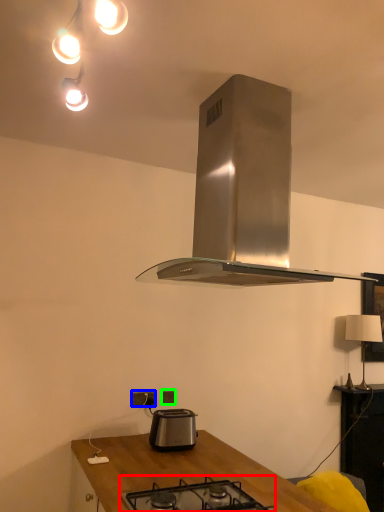
Question: Which object is the farthest from gas stove (highlighted by a red box)? Choose among these: power plugs and sockets (highlighted by a blue box) or power plugs and sockets (highlighted by a green box).

Choices:
 (A) power plugs and sockets
 (B) power plugs and sockets

Answer: (B)